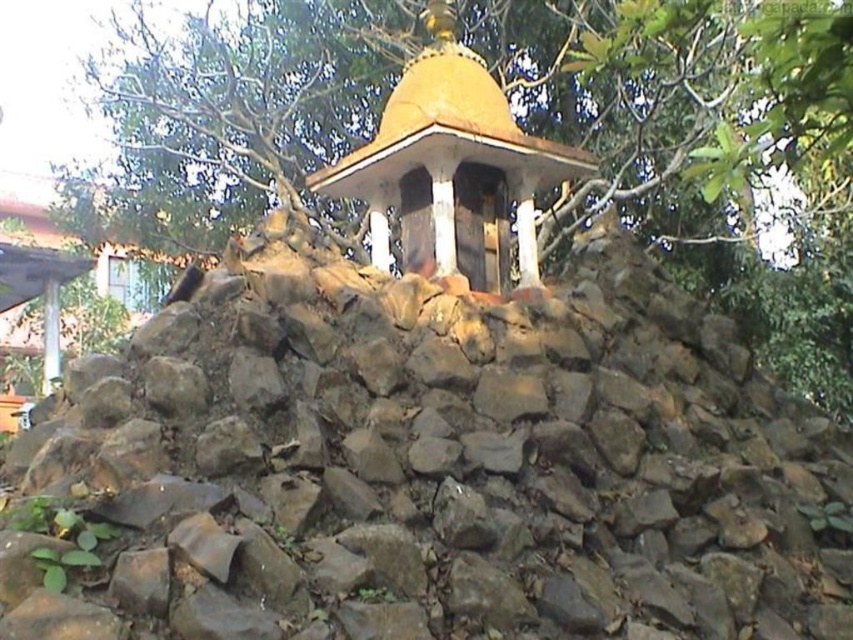
You are standing in front of the pavilion and want to know which object is taller between the brown rough stone at center and the green leafy tree at upper center. Can you determine this based on their positions?

The brown rough stone at center is shorter than the green leafy tree at upper center, so the green leafy tree at upper center is taller.

You are standing in front of the pavilion and want to place a small offering on the brown rough stone at center. Based on the coordinates provided, can you determine if the stone is positioned directly under the pavilion?

The brown rough stone at center is located at coordinates point (430, 467), which is directly under the pavilion.

You are standing in front of the pavilion and want to place a small offering on the brown rough stone at center. To do this, you need to walk around the green leafy tree at upper center. Which direction should you move relative to the tree?

The brown rough stone at center is positioned on the right side of the green leafy tree at upper center. Therefore, you should move to the right side of the green leafy tree at upper center to reach the brown rough stone at center.